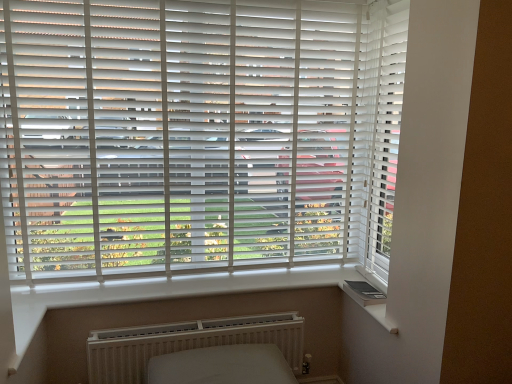
Where is `vacant area on top of white textured radiator at lower center (from a real-world perspective)`? vacant area on top of white textured radiator at lower center (from a real-world perspective) is located at coordinates (181, 324).